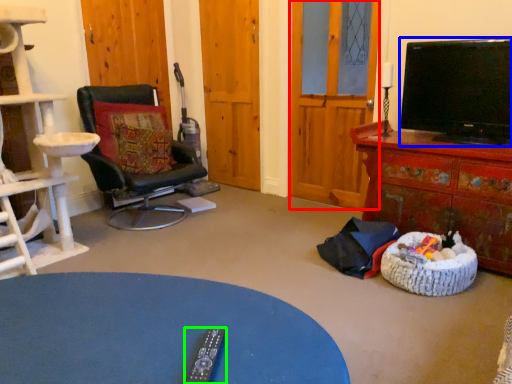
Question: Which object is positioned farthest from glass door (highlighted by a red box)? Select from television (highlighted by a blue box) and remote (highlighted by a green box).

Choices:
 (A) television
 (B) remote

Answer: (B)